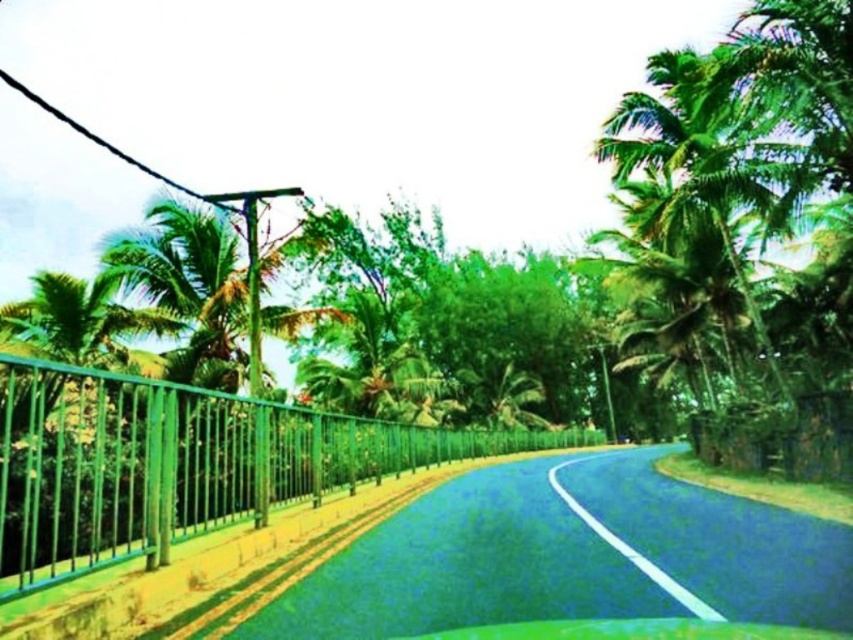
You are a drone operator planning to fly a drone from the green metal fence at left to the green leafy palm tree at upper right. The drone has a maximum flight range of 20 meters. Can the drone successfully reach the palm tree without needing to recharge?

The green metal fence at left is 18.66 meters from the green leafy palm tree at upper right. Since the drone has a maximum flight range of 20 meters, it can successfully reach the palm tree without needing to recharge.

You are a pedestrian standing on the road and want to walk towards the green leafy palm tree at upper right. Which object would you need to pass first, the green metal fence at left or the palm tree?

The green metal fence at left is in front of the green leafy palm tree at upper right, so you would need to pass the green metal fence at left first before reaching the palm tree.

From the picture: You are a drone operator trying to capture aerial shots of the road. You have two points marked on your map, point (44, 529) and point (730, 188). Which point is better for a closeup shot if you want the camera to be nearer to the subject?

Point (44, 529) is closer to the camera than point (730, 188), so it is better for a closeup shot as the camera will be nearer to the subject.